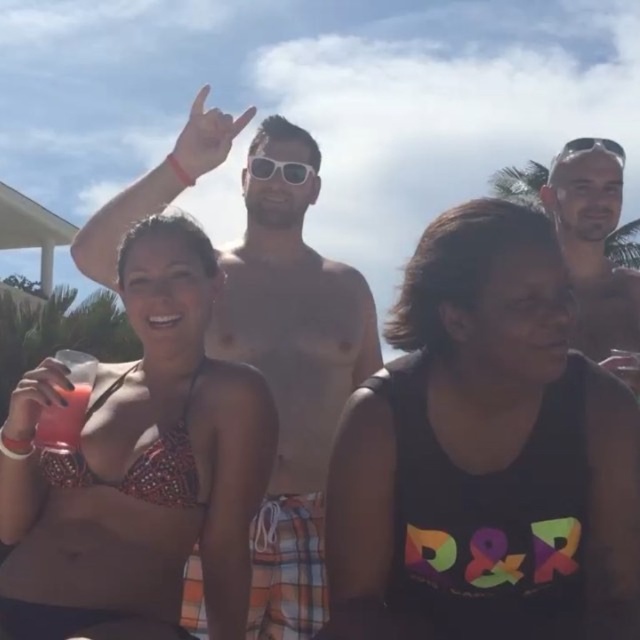
Question: Estimate the real-world distances between objects in this image. Which object is farther from the shiny silver necklace at upper center?

Choices:
 (A) sparkly red bikini top at lower left
 (B) sunglasses at upper right
 (C) sunglasses at center
 (D) matte black sunglasses at upper right

Answer: (B)

Question: Which point appears closest to the camera in this image?

Choices:
 (A) (70, 388)
 (B) (593, 330)
 (C) (195, 470)

Answer: (A)

Question: Is sparkly bikini top at center further to camera compared to sunglasses at upper right?

Choices:
 (A) yes
 (B) no

Answer: (B)

Question: Can you confirm if sparkly bikini top at center is positioned above matte black sunglasses at upper right?

Choices:
 (A) yes
 (B) no

Answer: (B)

Question: Is sparkly bikini top at center thinner than shiny silver necklace at upper center?

Choices:
 (A) no
 (B) yes

Answer: (B)

Question: Which object is positioned closest to the sparkly bikini top at center?

Choices:
 (A) black matte tank top at center
 (B) matte black sunglasses at upper right

Answer: (A)